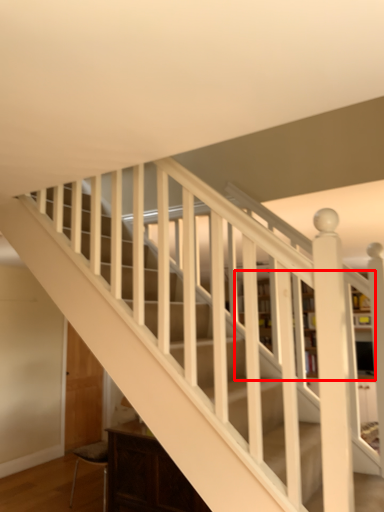
Question: In this image, where is bookcase (annotated by the red box) located relative to furniture?

Choices:
 (A) right
 (B) left

Answer: (A)